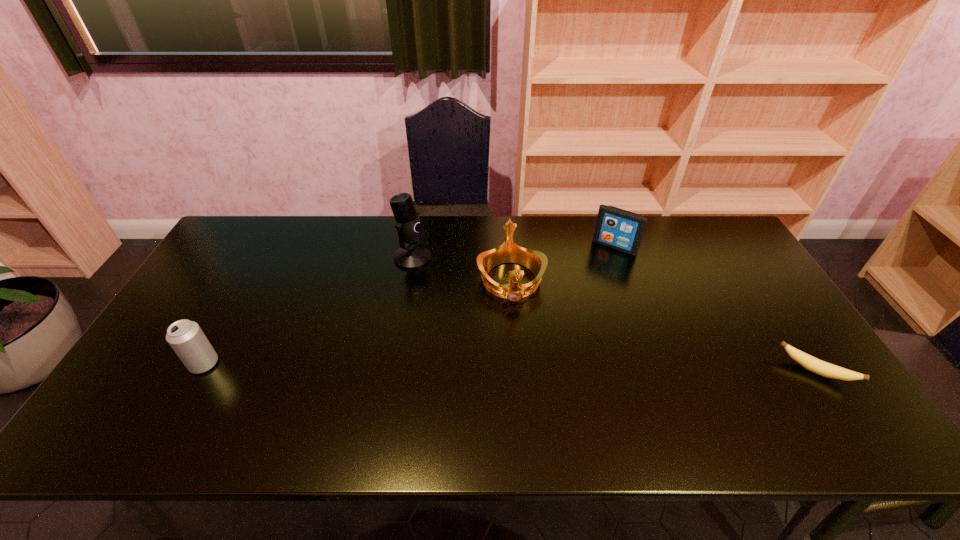
This screenshot has height=540, width=960. In order to click on free space on the desktop that is between the leftmost object and the banana and is positioned at the front emblem of the third object from left to right in this screenshot , I will do `click(521, 368)`.

Identify the location of vacant space on the desktop that is between the leftmost object and the banana and is positioned on the stand of the microphone. (564, 368).

The width and height of the screenshot is (960, 540). Identify the location of free space on the desktop that is between the beer can and the rightmost object and is positioned on the front screen of the second object from right to left. (540, 368).